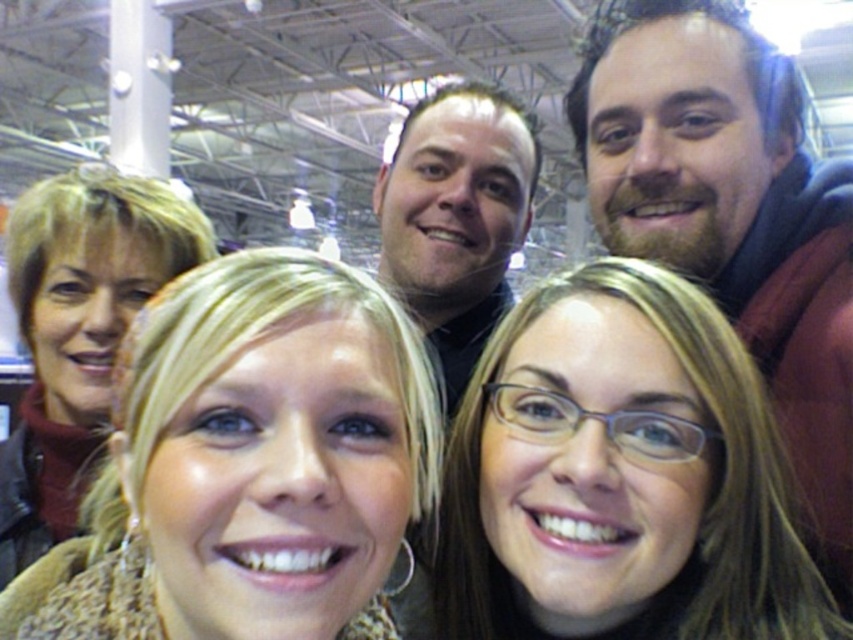
Question: Estimate the real-world distances between objects in this image. Which object is farther from the blonde hair at upper left?

Choices:
 (A) matte brown hair at center
 (B) bearded man at upper right
 (C) dark brown hair at upper center

Answer: (C)

Question: Does blonde hair at upper left have a smaller size compared to dark brown hair at upper center?

Choices:
 (A) no
 (B) yes

Answer: (A)

Question: Can you confirm if matte brown hair at center is positioned above dark brown hair at upper center?

Choices:
 (A) yes
 (B) no

Answer: (B)

Question: Which of the following is the farthest from the observer?

Choices:
 (A) (434, 208)
 (B) (448, 564)
 (C) (717, 228)

Answer: (A)

Question: Which point appears farthest from the camera in this image?

Choices:
 (A) click(38, 266)
 (B) click(625, 204)
 (C) click(642, 291)

Answer: (A)

Question: Is matte brown jacket at left smaller than blonde hair at upper left?

Choices:
 (A) yes
 (B) no

Answer: (A)